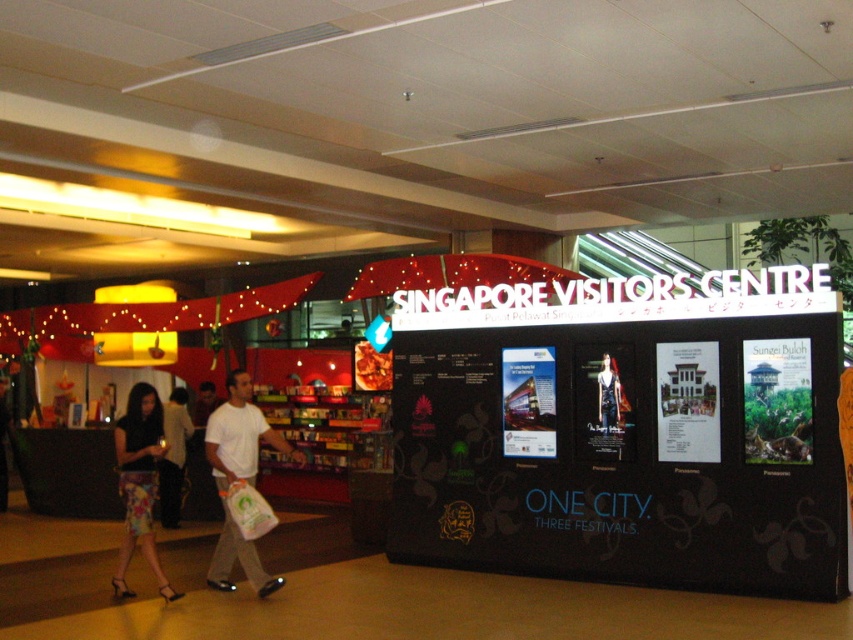
Question: Is white matte t-shirt at center above floral skirt at lower left?

Choices:
 (A) no
 (B) yes

Answer: (B)

Question: Can you confirm if white matte t-shirt at center is smaller than floral skirt at lower left?

Choices:
 (A) no
 (B) yes

Answer: (A)

Question: Is white matte t-shirt at center below floral skirt at lower left?

Choices:
 (A) no
 (B) yes

Answer: (A)